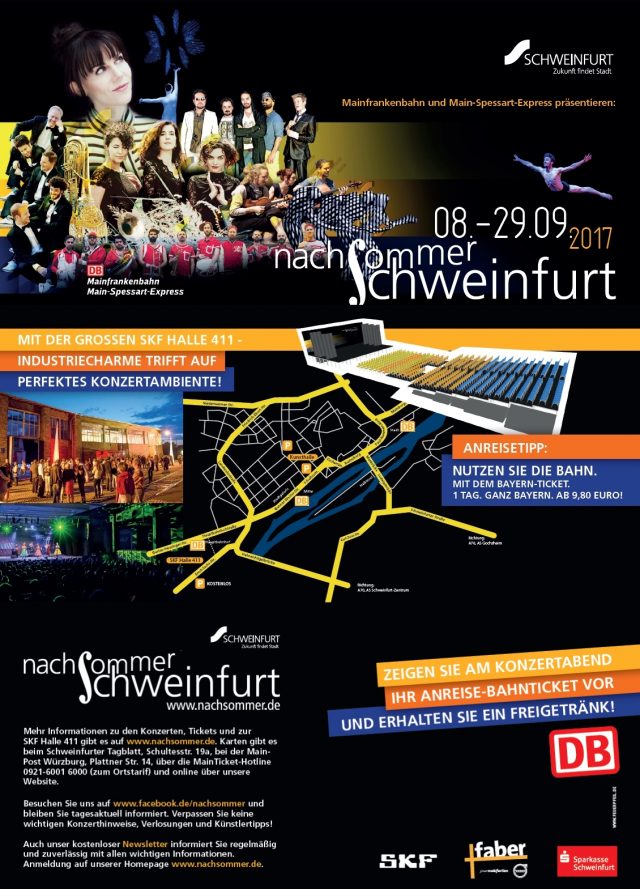
This screenshot has height=889, width=640. In order to click on lights in this screenshot , I will do `click(60, 531)`, `click(6, 529)`, `click(166, 430)`.